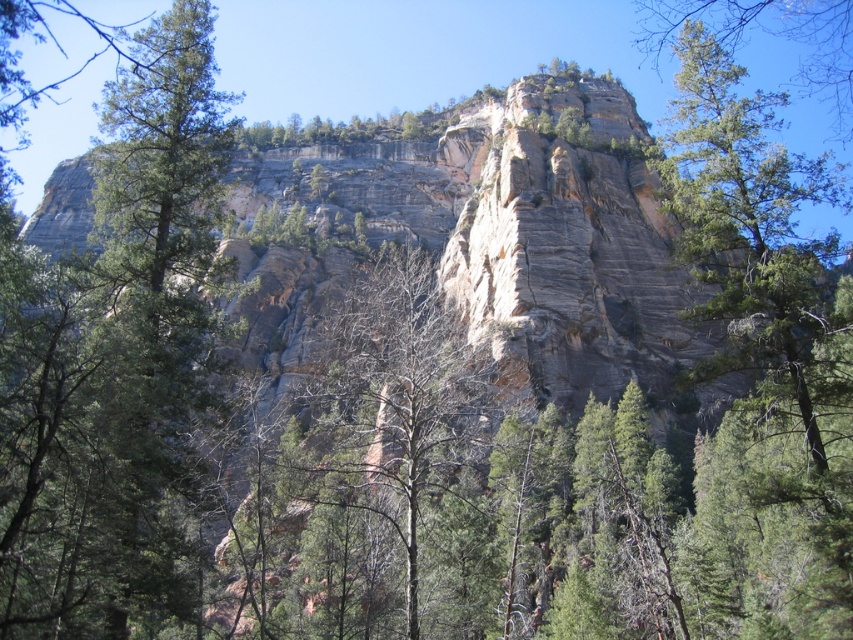
Question: Can you confirm if bare branches at center is thinner than green textured tree at upper right?

Choices:
 (A) no
 (B) yes

Answer: (B)

Question: Among these objects, which one is nearest to the camera?

Choices:
 (A) green textured tree at upper right
 (B) bare branches at center

Answer: (B)

Question: Which of the following is the farthest from the observer?

Choices:
 (A) green textured tree at upper right
 (B) bare branches at center

Answer: (A)

Question: Is bare branches at center behind green textured tree at upper right?

Choices:
 (A) yes
 (B) no

Answer: (B)

Question: Is bare branches at center bigger than green textured tree at upper right?

Choices:
 (A) yes
 (B) no

Answer: (B)

Question: Which of the following is the closest to the observer?

Choices:
 (A) (822, 26)
 (B) (379, 548)

Answer: (B)